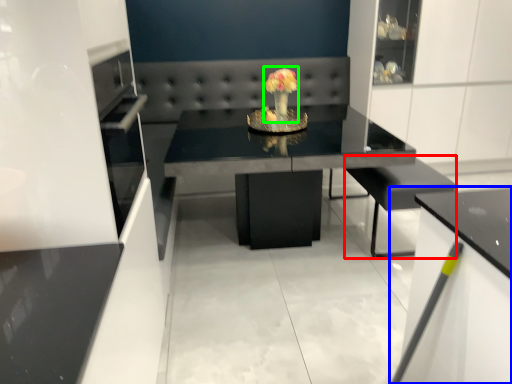
Question: Based on their relative distances, which object is farther from armchair (highlighted by a red box)? Choose from cabinetry (highlighted by a blue box) and floral arrangement (highlighted by a green box).

Choices:
 (A) cabinetry
 (B) floral arrangement

Answer: (B)